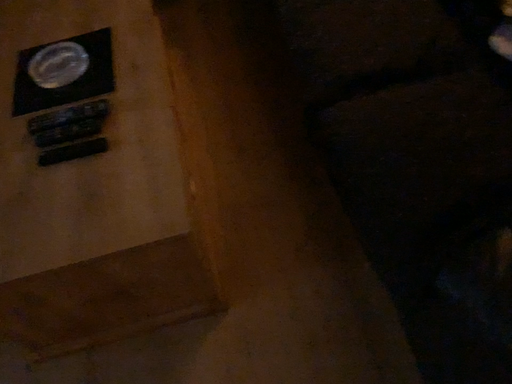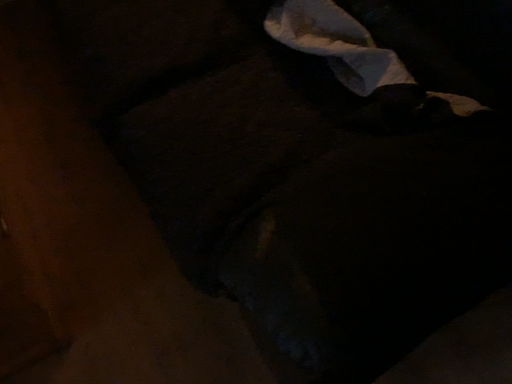
Question: How did the camera likely rotate when shooting the video?

Choices:
 (A) rotated right
 (B) rotated left

Answer: (A)